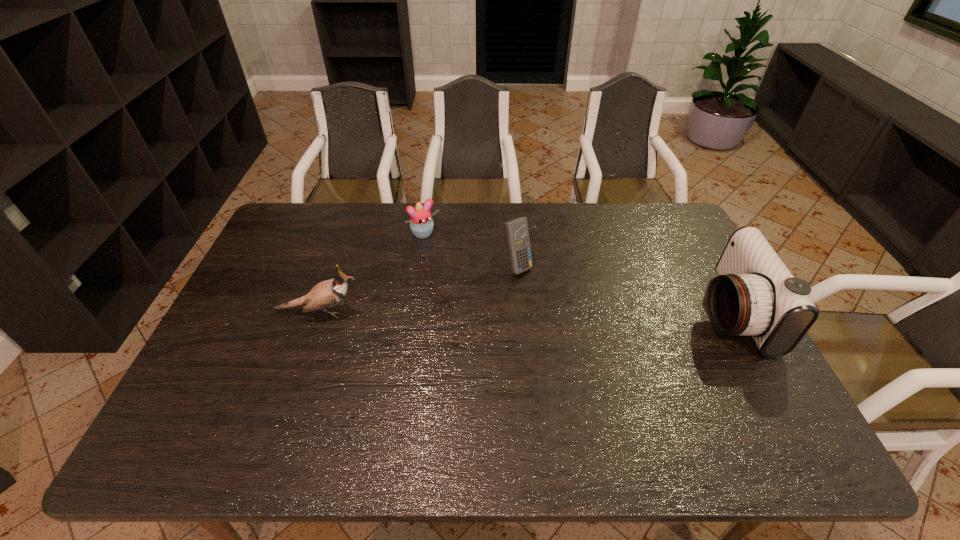
Where is `the leftmost object`? The height and width of the screenshot is (540, 960). the leftmost object is located at coordinates (326, 294).

The width and height of the screenshot is (960, 540). What are the coordinates of `the rightmost object` in the screenshot? It's located at pos(754,294).

Where is `the shortest object`? Image resolution: width=960 pixels, height=540 pixels. the shortest object is located at coordinates (421, 223).

The image size is (960, 540). Find the location of `the farthest object`. the farthest object is located at coordinates (421, 223).

Identify the location of the third object from left to right. (516, 231).

I want to click on vacant area situated at the face of the bird, so click(416, 311).

Identify the location of vacant space situated 0.350m on the surface of the rightmost object. (579, 313).

This screenshot has width=960, height=540. Identify the location of free space located 0.130m on the surface of the rightmost object. (657, 313).

The height and width of the screenshot is (540, 960). Find the location of `vacant space situated 0.330m on the surface of the rightmost object`. vacant space situated 0.330m on the surface of the rightmost object is located at coordinates (587, 313).

The width and height of the screenshot is (960, 540). I want to click on vacant region located 0.190m on the face of the farthest object, so click(459, 274).